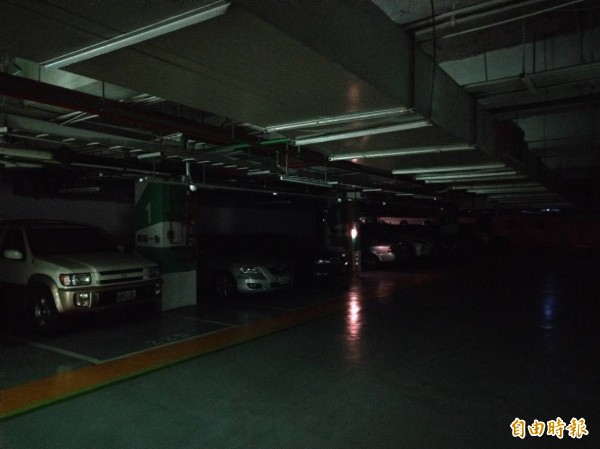
Locate an element on the screen. Image resolution: width=600 pixels, height=449 pixels. ceiling support beams is located at coordinates (526, 70), (574, 145).